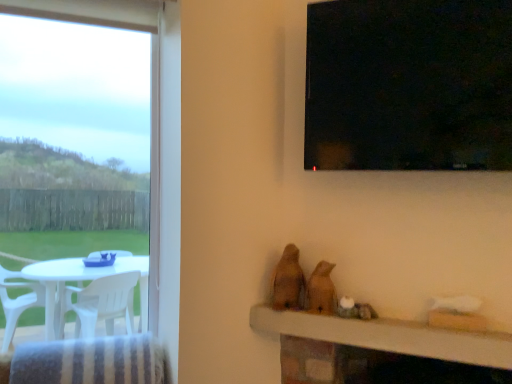
Question: Is wooden table at lower center situated inside transparent glass window at upper right or outside?

Choices:
 (A) outside
 (B) inside

Answer: (A)

Question: From a real-world perspective, relative to transparent glass window at upper right, is wooden table at lower center vertically above or below?

Choices:
 (A) above
 (B) below

Answer: (B)

Question: Estimate the real-world distances between objects in this image. Which object is farther from the brown matte bird at center, the first animal from the right?

Choices:
 (A) brown matte bird at center, the 1th animal viewed from the left
 (B) wooden table at lower center
 (C) transparent glass window at upper right

Answer: (C)

Question: Considering the real-world distances, which object is farthest from the wooden table at lower center?

Choices:
 (A) brown matte bird at center, the 1th animal viewed from the left
 (B) brown matte bird at center, the first animal from the right
 (C) transparent glass window at upper right

Answer: (C)